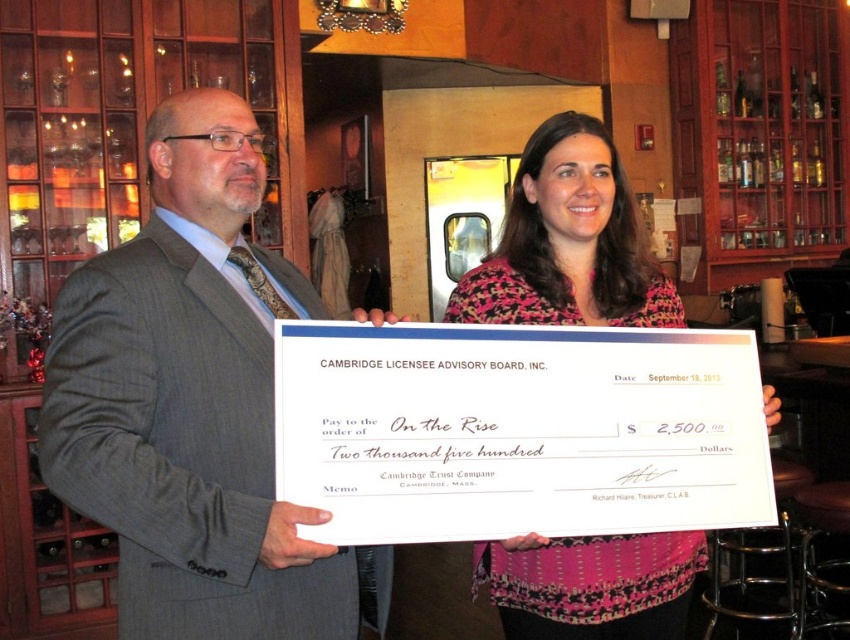
Based on the photo, can you confirm if gray pinstripe suit at center is smaller than pink floral blouse at center?

Actually, gray pinstripe suit at center might be larger than pink floral blouse at center.

Is point (76, 381) behind point (547, 216)?

That is False.

Which is behind, point (242, 189) or point (531, 253)?

Point (531, 253)

Locate an element on the screen. The height and width of the screenshot is (640, 850). gray pinstripe suit at center is located at coordinates [x=194, y=404].